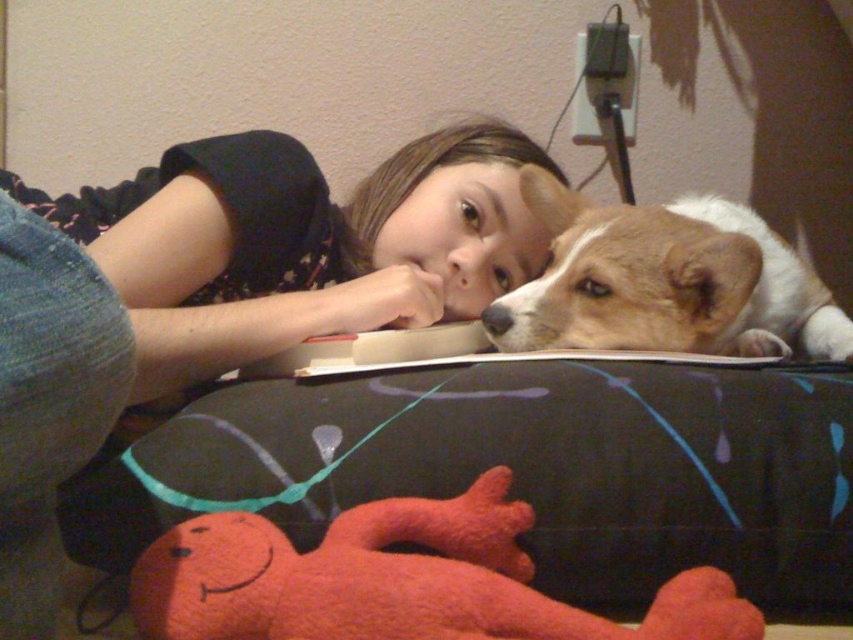
Between point (776, 372) and point (91, 228), which one is positioned in front?

Positioned in front is point (776, 372).

Is point (256, 442) less distant than point (248, 301)?

Yes, point (256, 442) is in front of point (248, 301).

At what (x,y) coordinates should I click in order to perform the action: click on black fabric pillow at lower center. Please return your answer as a coordinate pair (x, y). This screenshot has width=853, height=640. Looking at the image, I should click on (523, 468).

This screenshot has height=640, width=853. I want to click on black fabric pillow at lower center, so coord(523,468).

Can you confirm if black fabric pillow at lower center is positioned above fluffy red plush at lower center?

Yes.

Is black fabric pillow at lower center below fluffy red plush at lower center?

No.

Which is in front, point (584, 458) or point (270, 564)?

Point (270, 564) is more forward.

Find the location of a particular element. The image size is (853, 640). black fabric pillow at lower center is located at coordinates (523, 468).

Does matte black shirt at upper center have a lesser width compared to fluffy red plush at lower center?

Incorrect, matte black shirt at upper center's width is not less than fluffy red plush at lower center's.

What do you see at coordinates (299, 244) in the screenshot?
I see `matte black shirt at upper center` at bounding box center [299, 244].

The width and height of the screenshot is (853, 640). I want to click on matte black shirt at upper center, so click(299, 244).